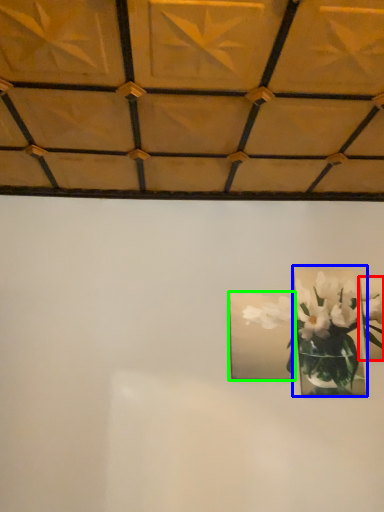
Question: Based on their relative distances, which object is nearer to picture frame (highlighted by a red box)? Choose from picture frame (highlighted by a blue box) and picture frame (highlighted by a green box).

Choices:
 (A) picture frame
 (B) picture frame

Answer: (A)